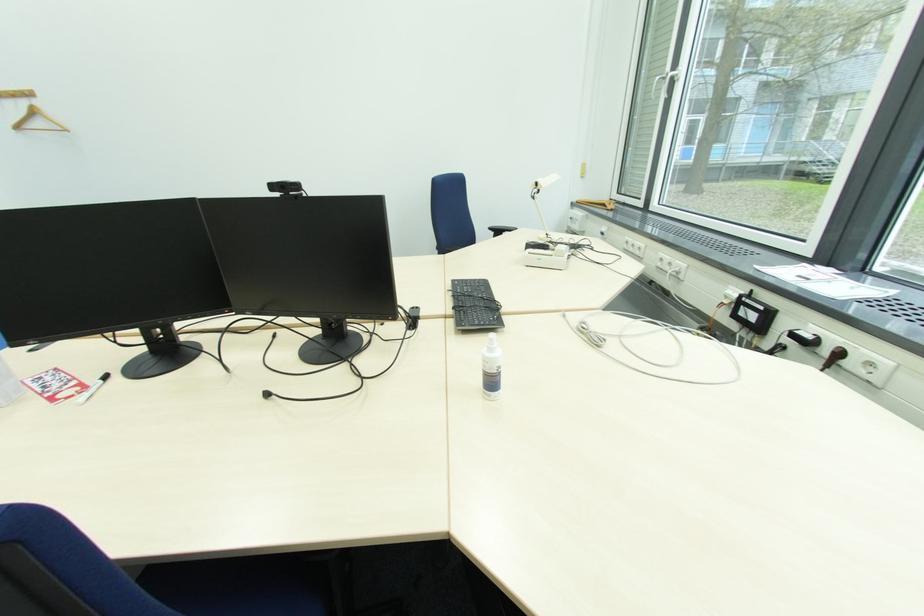
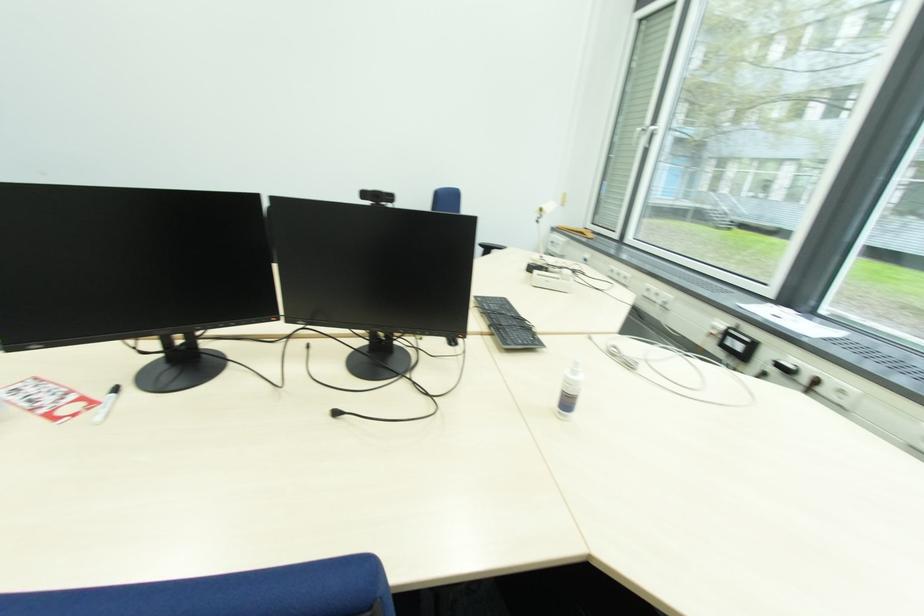
Locate, in the second image, the point that corresponds to the point at 675,75 in the first image.

(655, 130)